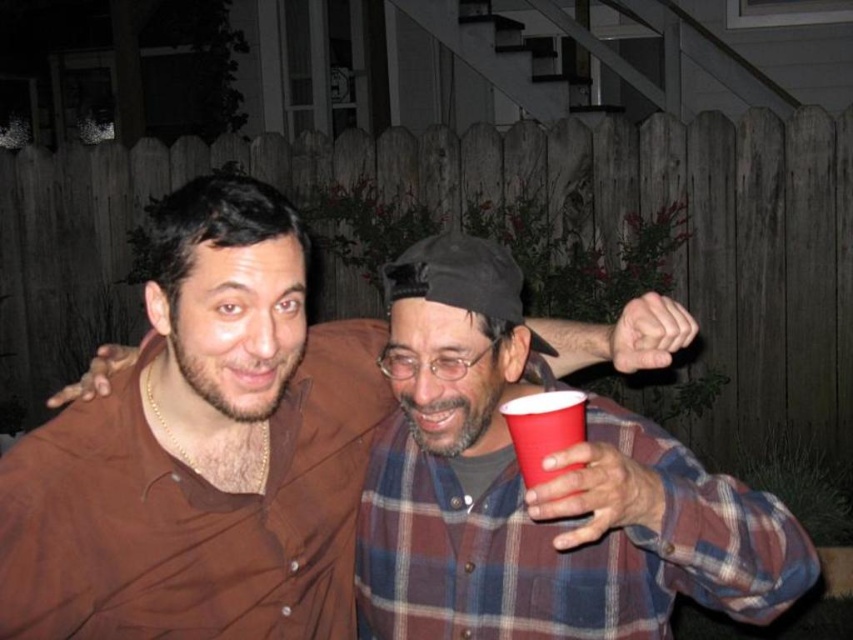
Based on the scene description, where is the plaid fabric at center located in terms of coordinates?

The plaid fabric at center is located at coordinates point [538,490].

You are a photographer standing in front of the two people in the image. You want to take a photo that clearly shows both the plaid fabric at center and the matte plastic cup at lower right. Which object should you focus on first to ensure both are in focus?

The plaid fabric at center is in front of the matte plastic cup at lower right, so you should focus on the plaid fabric at center first to ensure both are in focus.

Based on the scene description, which object is taller between the matte brown shirt at center and the plaid fabric at center?

The matte brown shirt at center is much taller than the plaid fabric at center according to the description.